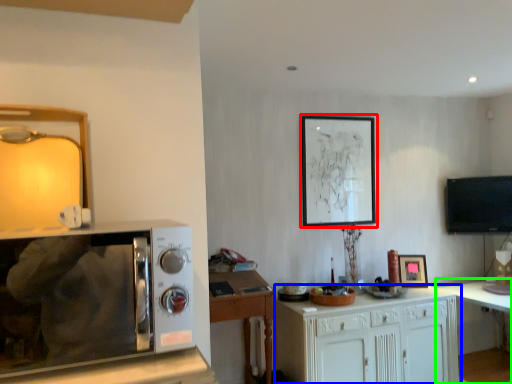
Question: Which object is the closest to the picture frame (highlighted by a red box)? Choose among these: cabinetry (highlighted by a blue box) or table (highlighted by a green box).

Choices:
 (A) cabinetry
 (B) table

Answer: (A)